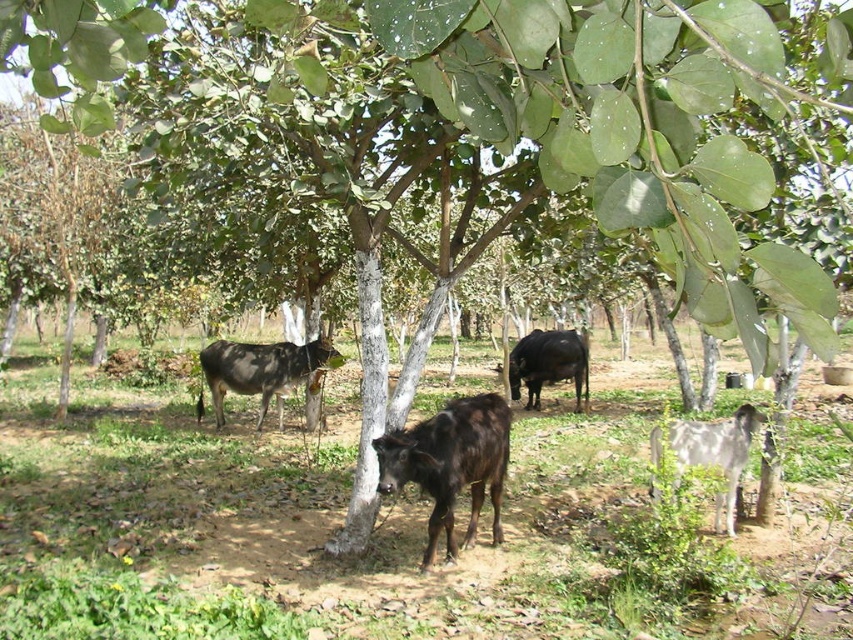
Question: Is shiny black cow at center in front of black glossy cow at center?

Choices:
 (A) yes
 (B) no

Answer: (A)

Question: Which object appears farthest from the camera in this image?

Choices:
 (A) green grass at center
 (B) black glossy cow at center

Answer: (B)

Question: Which of these objects is positioned farthest from the black glossy cow at center?

Choices:
 (A) white woolly goat at lower right
 (B) dark brown glossy cow at center

Answer: (A)

Question: Is green grass at center further to the viewer compared to black glossy cow at center?

Choices:
 (A) no
 (B) yes

Answer: (A)

Question: Does dark brown glossy cow at center have a smaller size compared to white woolly goat at lower right?

Choices:
 (A) yes
 (B) no

Answer: (B)

Question: Which object appears closest to the camera in this image?

Choices:
 (A) shiny black cow at center
 (B) white woolly goat at lower right

Answer: (A)